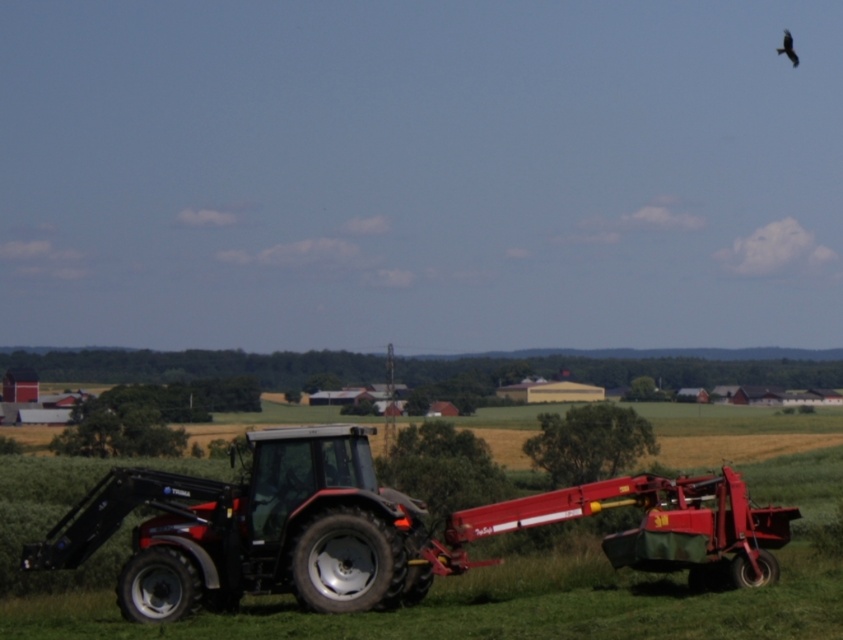
You are a drone operator flying a drone that is 1.2 meters in height. You want to fly the drone over the matte black tractor at center and the black feathered bird at upper right. Will the drone be able to fly over both objects without any issues?

The matte black tractor at center is not as tall as the black feathered bird at upper right. Since the drone is 1.2 meters in height, it should be able to fly over both objects as long as the bird is not flying higher than the drone can reach. However, the exact height of the bird is not specified, so there might be a risk if the bird is above the drone.

You are a farmer planning to move the matte black tractor at center to a storage shed located at the edge of the field. The shed is 20 meters away from the tractor. Can the tractor reach the shed without needing to move any obstacles?

The matte black tractor at center is 17.47 meters away from the shed, so yes, the tractor can reach the shed without needing to move any obstacles since the distance is within the required 20 meters.

You are standing at the black tractor with red accents in the rural landscape. You see two points marked on the ground ahead of you, labeled as point 1 at coordinates point (384,506) and point 2 at coordinates point (787,52). Which point is closer to you?

Point 1 at coordinates point (384,506) is closer to you because it is in front of point 2 at coordinates point (787,52).